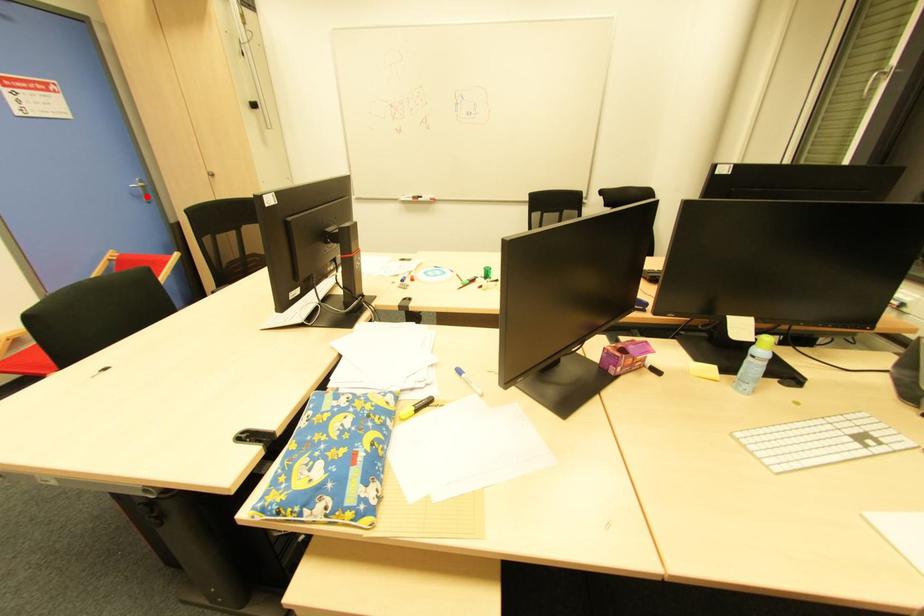
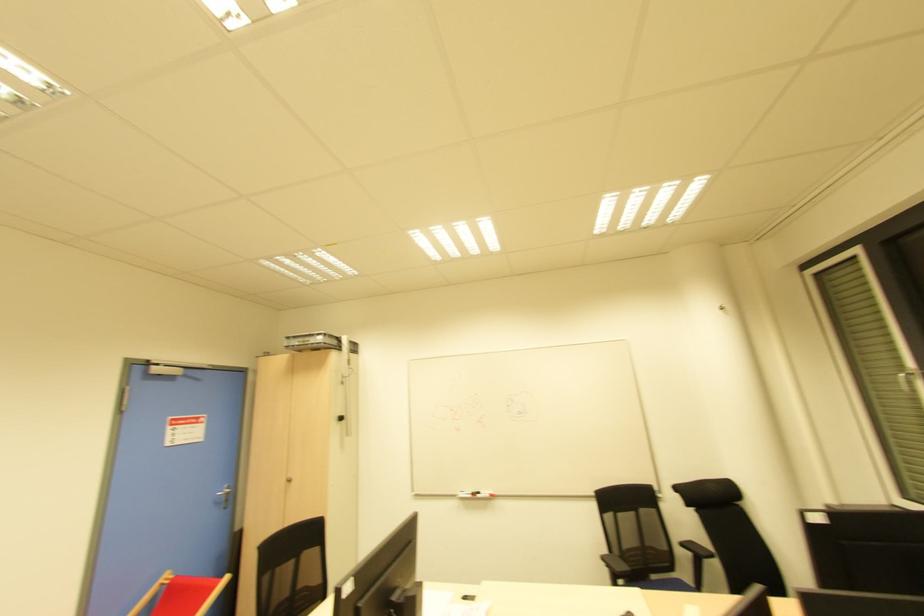
Where in the second image is the point corresponding to the highlighted location from the first image?

(225, 501)